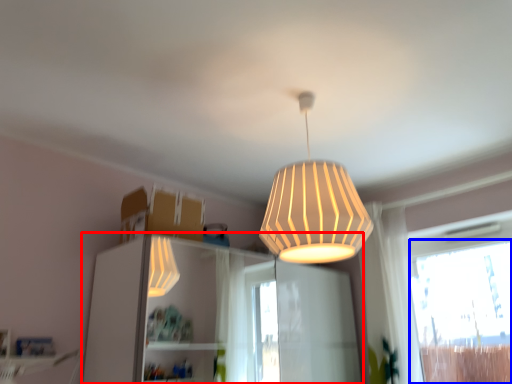
Question: Among these objects, which one is nearest to the camera, dresser (highlighted by a red box) or window (highlighted by a blue box)?

Choices:
 (A) dresser
 (B) window

Answer: (A)